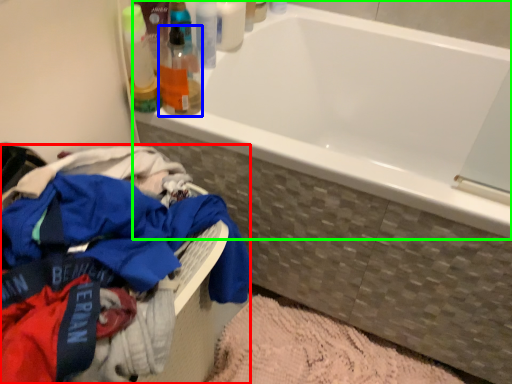
Question: Considering the real-world distances, which object is farthest from clothing (highlighted by a red box)? toiletry (highlighted by a blue box) or bathtub (highlighted by a green box)?

Choices:
 (A) toiletry
 (B) bathtub

Answer: (B)